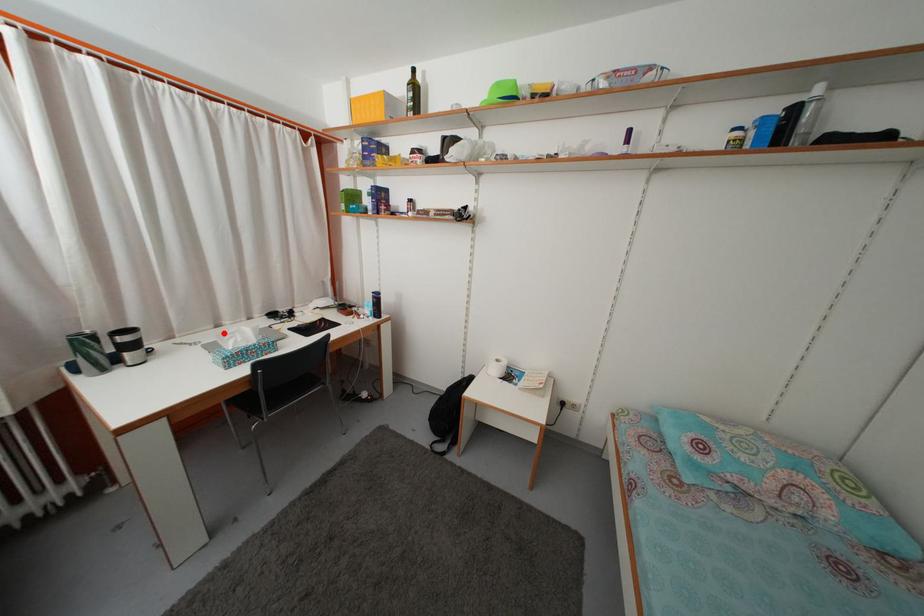
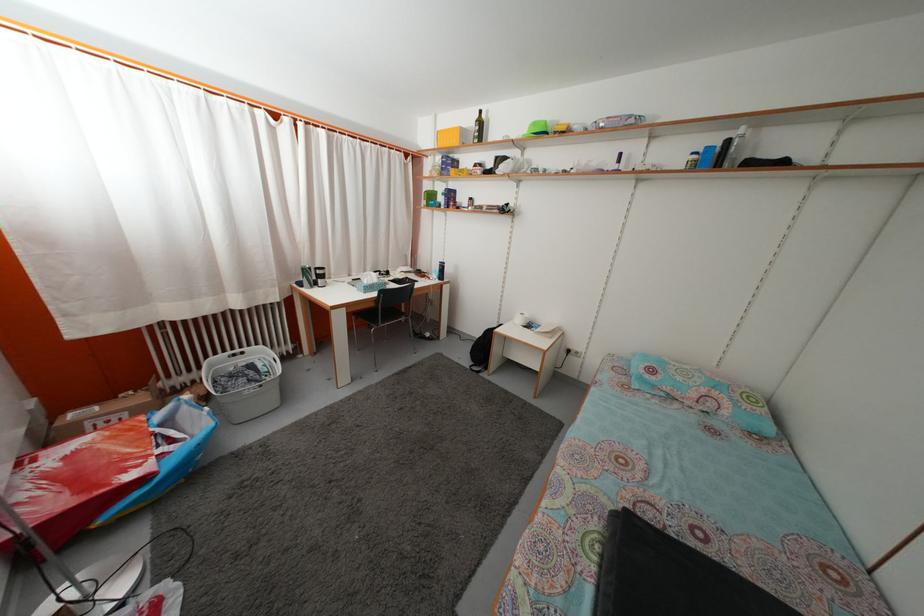
Locate, in the second image, the point that corresponds to the highlighted location in the first image.

(355, 283)